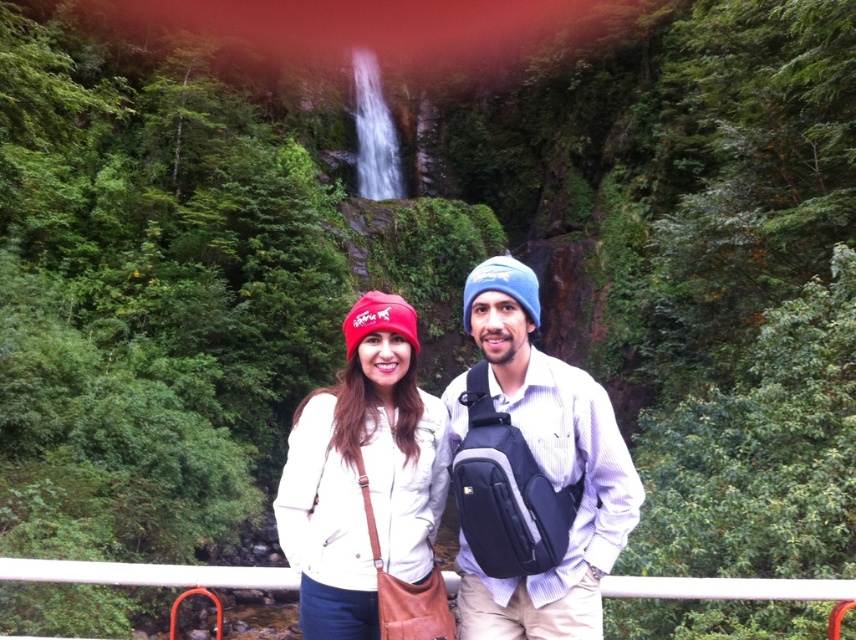
From the picture: You are a photographer trying to capture a photo of both the blue fabric beanie at center and the matte red beanie at center. Based on their positions, which beanie should you focus on first to ensure both are in frame?

The blue fabric beanie at center is below the matte red beanie at center, so you should focus on the matte red beanie at center first to ensure both are in frame.